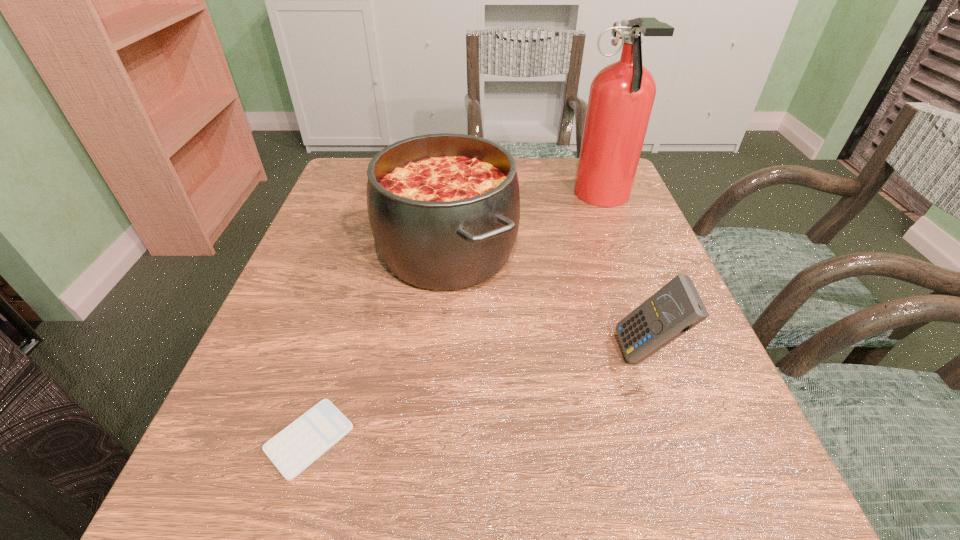
Find the location of `vacant space located 0.380m on the front-facing side of the third farthest object`. vacant space located 0.380m on the front-facing side of the third farthest object is located at coordinates (390, 353).

Locate an element on the screen. blank area located 0.400m on the right of the nearer calculator is located at coordinates (635, 439).

The image size is (960, 540). I want to click on fire extinguisher that is at the far edge, so click(622, 94).

The width and height of the screenshot is (960, 540). I want to click on casserole that is at the far edge, so click(x=444, y=209).

The width and height of the screenshot is (960, 540). Find the location of `object situated at the near edge`. object situated at the near edge is located at coordinates (296, 447).

This screenshot has width=960, height=540. In order to click on casserole that is at the left edge in this screenshot , I will do `click(444, 209)`.

Find the location of a particular element. calculator that is at the left edge is located at coordinates (296, 447).

The width and height of the screenshot is (960, 540). Identify the location of fire extinguisher at the right edge. (622, 94).

This screenshot has width=960, height=540. I want to click on calculator present at the right edge, so click(676, 308).

Image resolution: width=960 pixels, height=540 pixels. What are the coordinates of `object that is at the far left corner` in the screenshot? It's located at (444, 209).